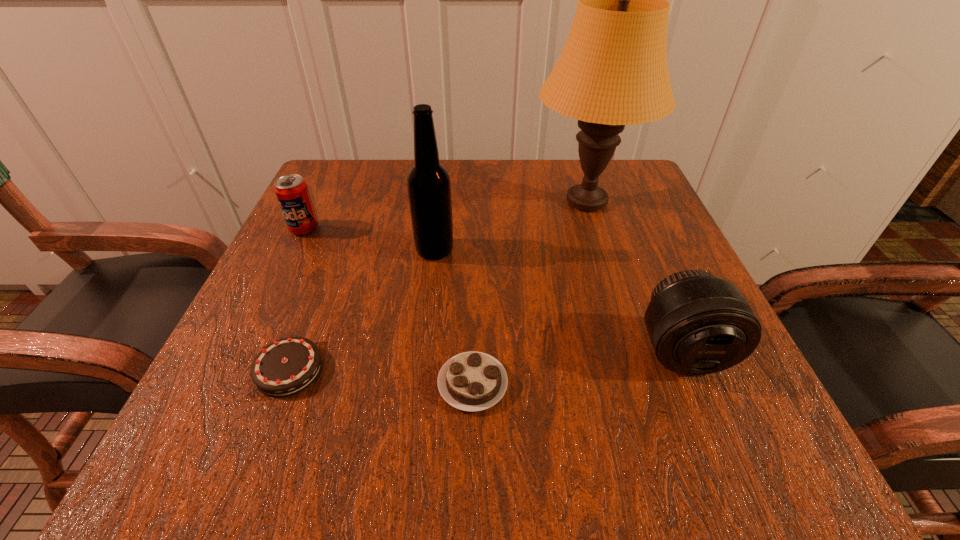
Locate an element on the screen. Image resolution: width=960 pixels, height=540 pixels. the tallest object is located at coordinates (613, 71).

At what (x,y) coordinates should I click in order to perform the action: click on the third farthest object. Please return your answer as a coordinate pair (x, y). The image size is (960, 540). Looking at the image, I should click on (429, 189).

Where is `the second tallest object`? This screenshot has height=540, width=960. the second tallest object is located at coordinates (429, 189).

In order to click on telephoto lens in this screenshot , I will do `click(698, 324)`.

Where is `soda can`? This screenshot has width=960, height=540. soda can is located at coordinates (291, 190).

I want to click on the left chocolate cake, so click(x=287, y=366).

Where is `the right chocolate cake`? This screenshot has width=960, height=540. the right chocolate cake is located at coordinates (472, 381).

At what (x,y) coordinates should I click in order to perform the action: click on free space located 0.380m on the front of the tallest object. Please return your answer as a coordinate pair (x, y). The height and width of the screenshot is (540, 960). Looking at the image, I should click on (651, 407).

Identify the location of free region located 0.320m on the right of the beer bottle. (621, 250).

Where is `vacant space located on the front of the fourth tallest object`? vacant space located on the front of the fourth tallest object is located at coordinates (209, 425).